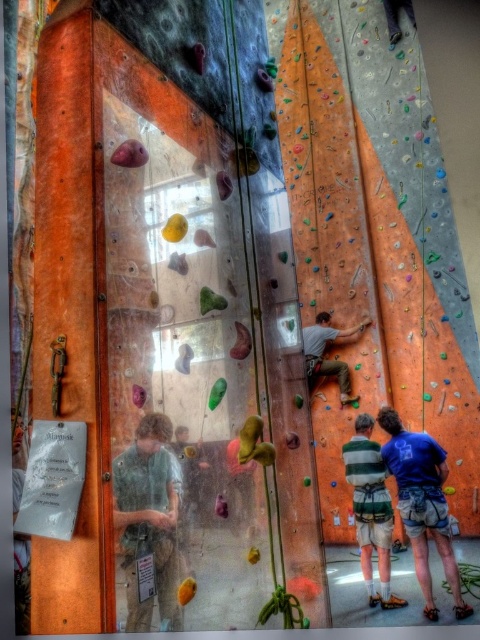
You are standing at the entrance of the rock climbing facility and see the green fabric shirt at lower left and the striped cotton shirt at center. Which observer is closer to the left side of the image?

The green fabric shirt at lower left is closer to the left side of the image because it is positioned to the left of the striped cotton shirt at center.

You are standing at the entrance of the climbing facility and want to reach the two points marked in the image. Which point, point (166, 605) or point (367, 438), is closer to you?

Point (166, 605) is closer to the viewer than point (367, 438), so you would reach it first.

You are a photographer standing at the entrance of the climbing facility. You want to take a photo that includes both the blue cotton shirt at lower right and the striped cotton shirt at center. Which shirt will appear smaller in the photo?

The blue cotton shirt at lower right is shorter than the striped cotton shirt at center, so in the photo, the blue cotton shirt at lower right will appear smaller.